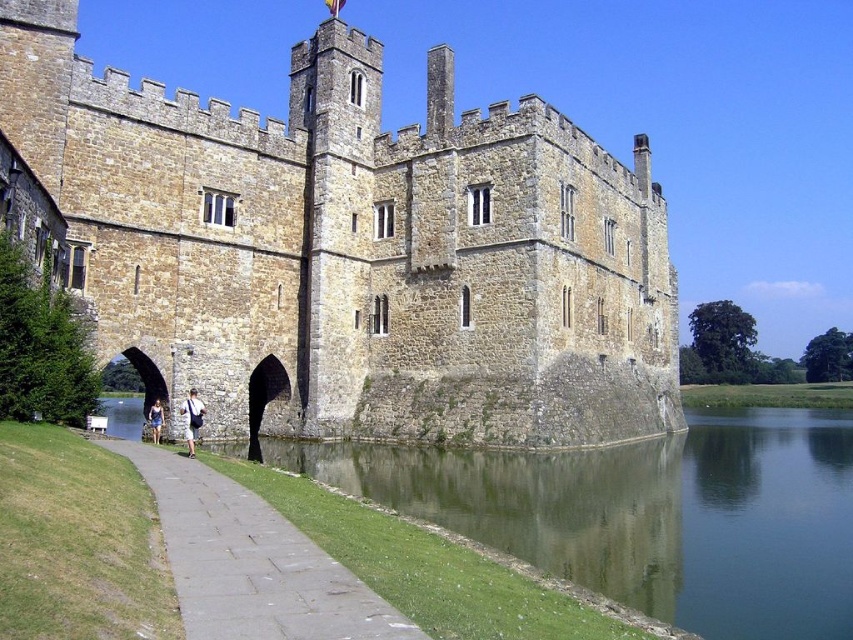
You are a tourist visiting the castle and want to take a photo of the castle from the lower left area. There are two options for your position here. One is standing on the green grassy bank at lower left, and the other is standing on the gray stone path at lower left. Which position would give you a better view of the castle?

The green grassy bank at lower left is much taller than the gray stone path at lower left, so standing on the green grassy bank at lower left would provide a better elevated view of the castle.

You are a painter who wants to capture the scene of the brown stone castle at center and the green grassy bank at lower left in a painting. Which object should you draw first if you want to follow the rule of placing wider objects in the background for depth perception?

The green grassy bank at lower left should be drawn first as it is wider than the brown stone castle at center, so placing it in the background would create depth perception by having wider objects in the back.